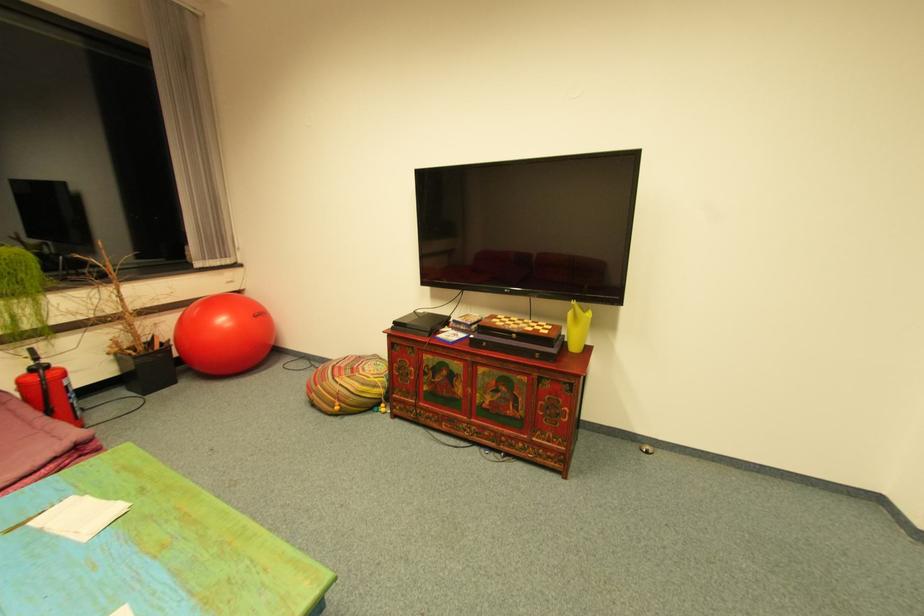
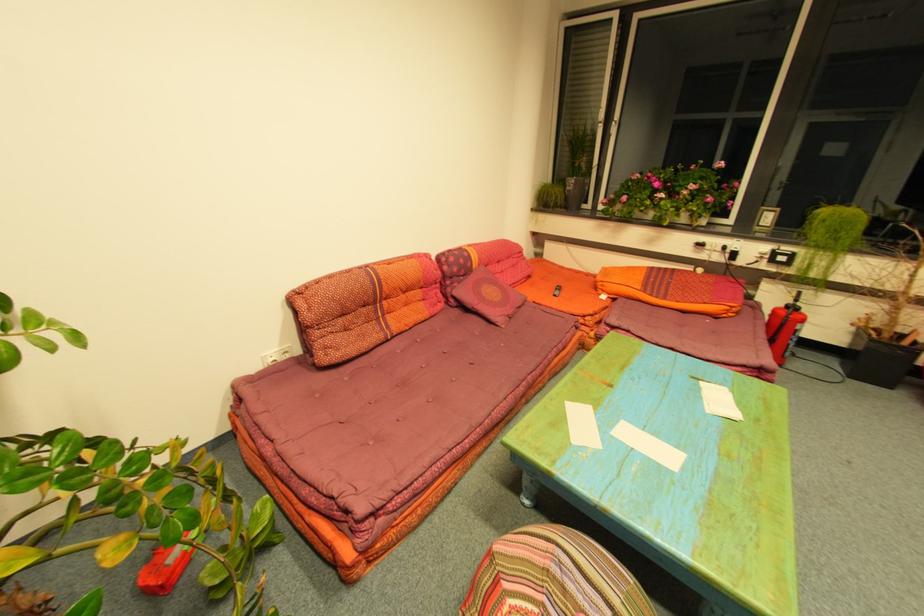
The images are taken continuously from a first-person perspective. In which direction is your viewpoint rotating?

The rotation direction of the camera is left-down.